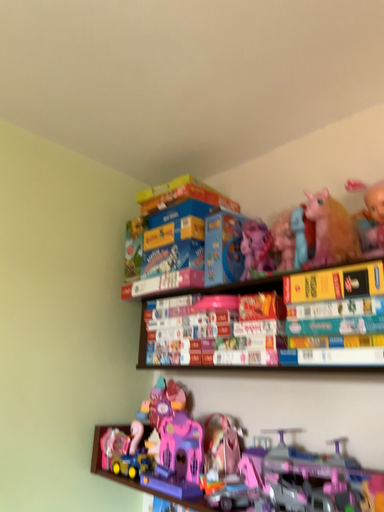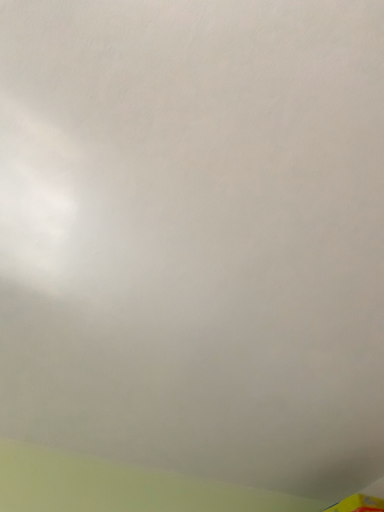
Question: Which way did the camera rotate in the video?

Choices:
 (A) rotated left
 (B) rotated right

Answer: (A)